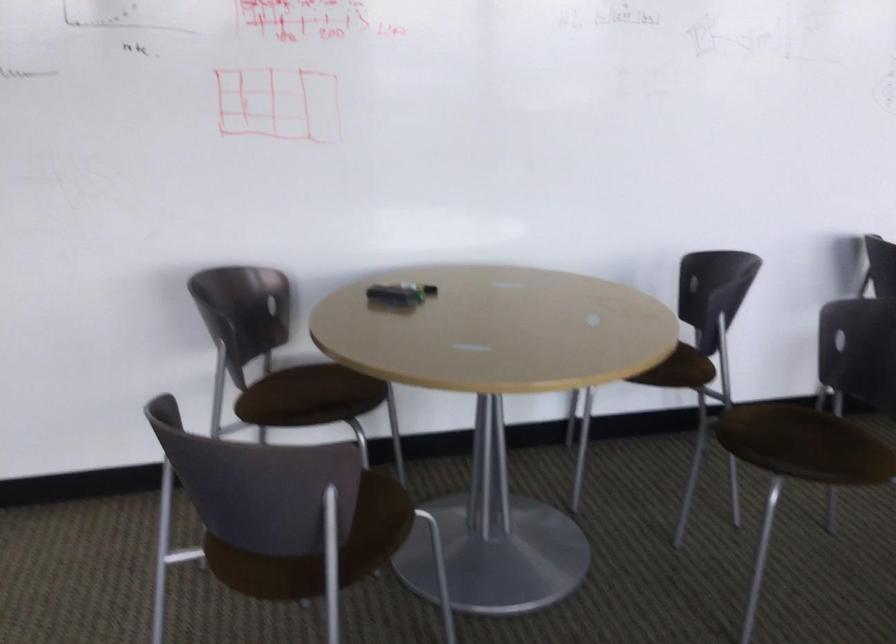
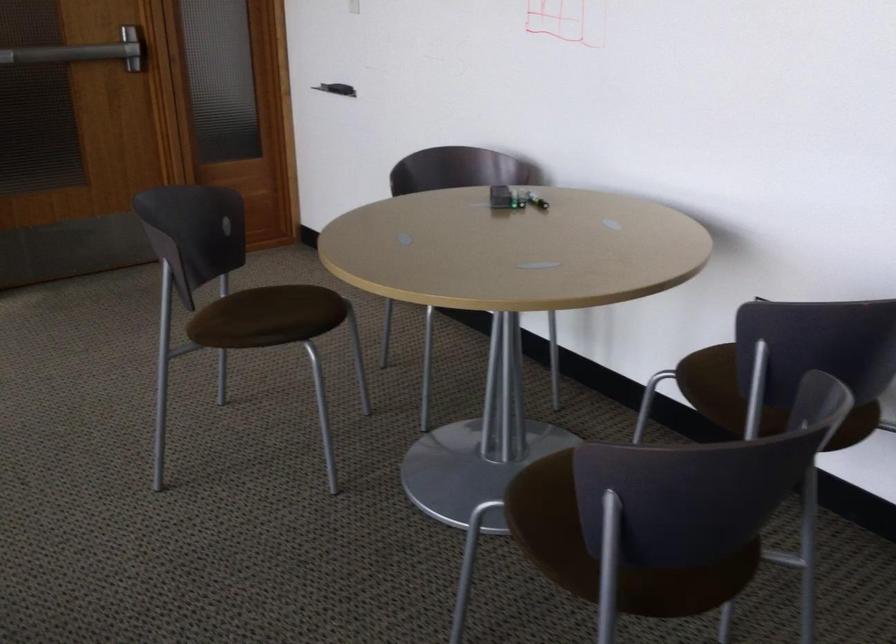
Question: I am providing you with two images of the same scene from different viewpoints. After the viewpoint changes to image2, which objects are now occluded?

Choices:
 (A) brown chair sitting surface
 (B) black whiteboard marker
 (C) silver door handle
 (D) black whiteboard eraser

Answer: (A)